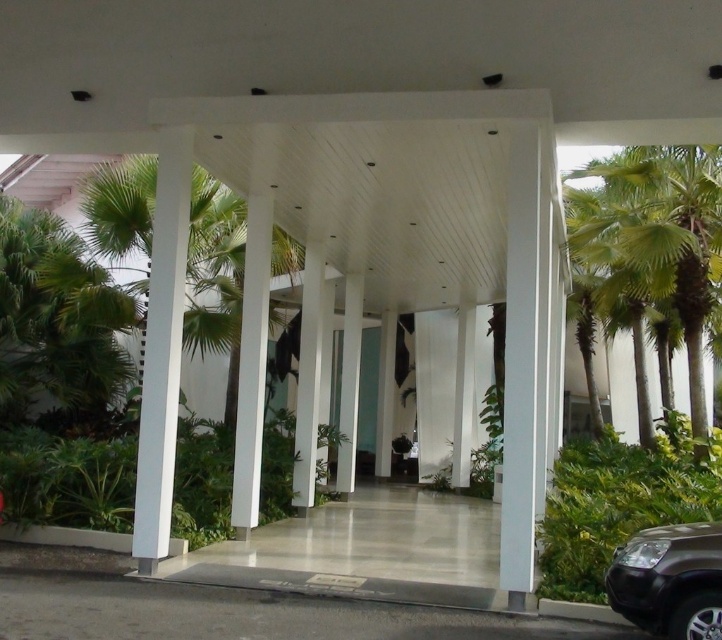
Question: Can you confirm if green leafy palm tree at right is positioned above satin brown suv at lower right?

Choices:
 (A) yes
 (B) no

Answer: (A)

Question: Is white glossy pillar at right thinner than satin brown suv at lower right?

Choices:
 (A) yes
 (B) no

Answer: (A)

Question: Which of the following is the farthest from the observer?

Choices:
 (A) (606, 172)
 (B) (508, 378)
 (C) (656, 529)

Answer: (A)

Question: Based on their relative distances, which object is farther from the white glossy pillar at right?

Choices:
 (A) green leafy palm tree at right
 (B) satin brown suv at lower right

Answer: (A)

Question: Is green leafy palm tree at right thinner than satin brown suv at lower right?

Choices:
 (A) no
 (B) yes

Answer: (A)

Question: Which point appears closest to the camera in this image?

Choices:
 (A) (583, 225)
 (B) (692, 529)

Answer: (B)